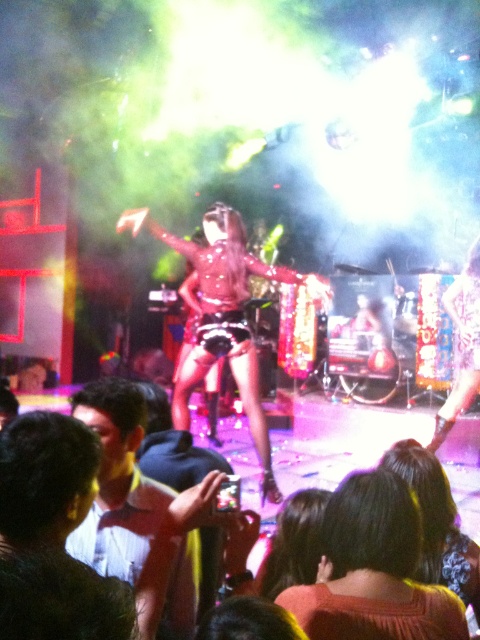
Can you confirm if brown textured sweater at lower center is positioned below white glossy shirt at lower left?

Indeed, brown textured sweater at lower center is positioned under white glossy shirt at lower left.

Who is lower down, brown textured sweater at lower center or white glossy shirt at lower left?

brown textured sweater at lower center is lower down.

What do you see at coordinates (372, 570) in the screenshot? I see `brown textured sweater at lower center` at bounding box center [372, 570].

Where is `brown textured sweater at lower center`? Image resolution: width=480 pixels, height=640 pixels. brown textured sweater at lower center is located at coordinates (372, 570).

Is point (190, 536) closer to camera compared to point (218, 227)?

That is True.

Is point (124, 394) positioned in front of point (286, 275)?

Yes, point (124, 394) is in front of point (286, 275).

Find the location of `white glossy shirt at lower left`. white glossy shirt at lower left is located at coordinates (118, 483).

Can you confirm if brown textured sweater at lower center is smaller than shiny metallic outfit at center?

Indeed, brown textured sweater at lower center has a smaller size compared to shiny metallic outfit at center.

In the scene shown: Which is below, brown textured sweater at lower center or shiny metallic outfit at center?

brown textured sweater at lower center is below.

The height and width of the screenshot is (640, 480). In order to click on brown textured sweater at lower center in this screenshot , I will do point(372,570).

This screenshot has width=480, height=640. Identify the location of brown textured sweater at lower center. (372, 570).